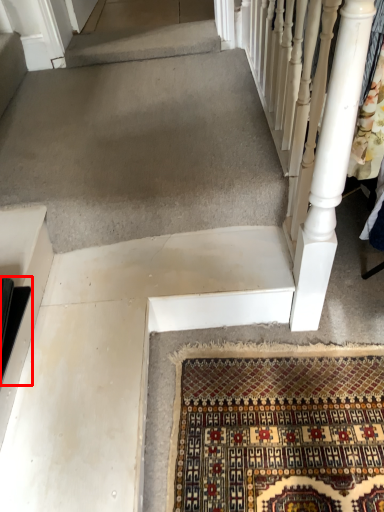
Question: From the image, what is the correct spatial relationship of stairs (annotated by the red box) in relation to rail?

Choices:
 (A) left
 (B) right

Answer: (A)